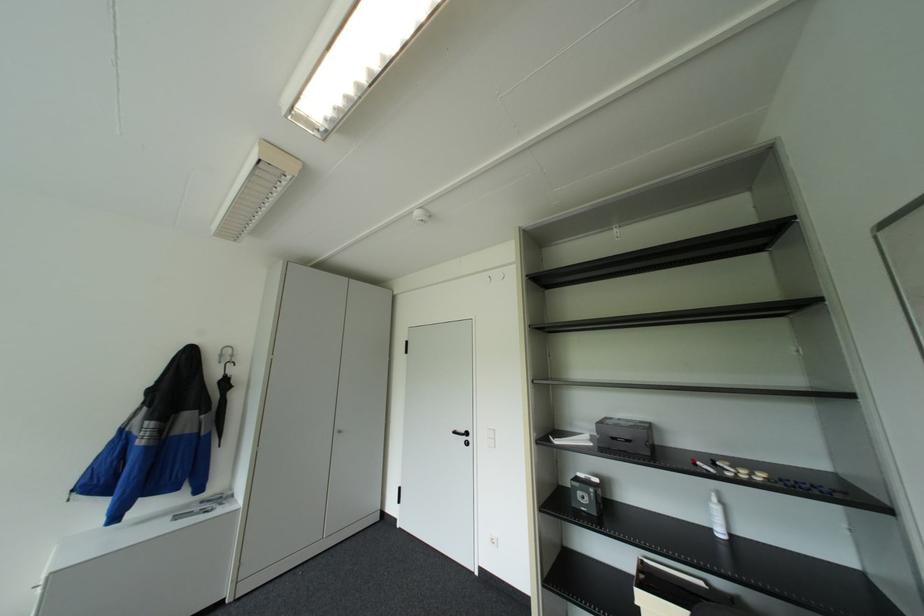
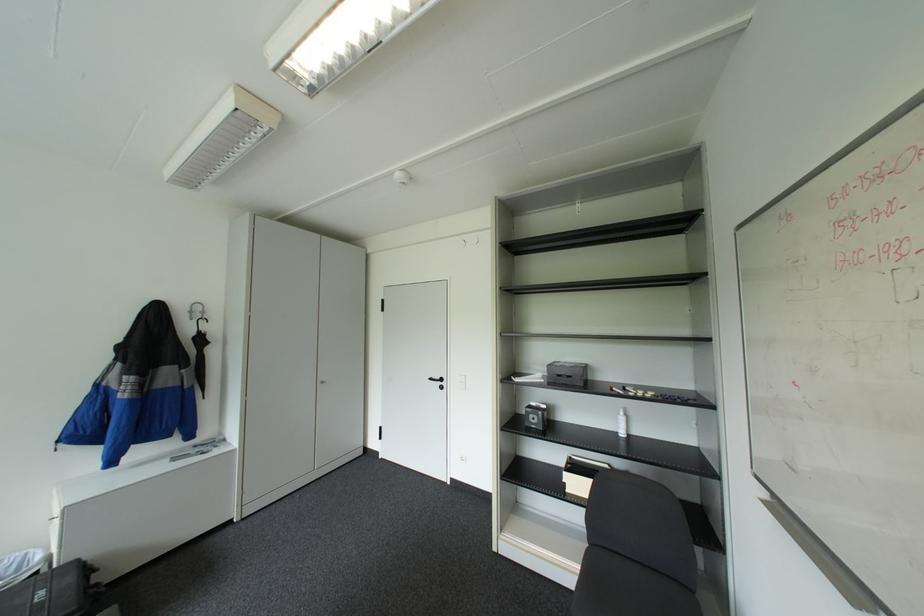
The point at (463, 431) is marked in the first image. Where is the corresponding point in the second image?

(439, 378)